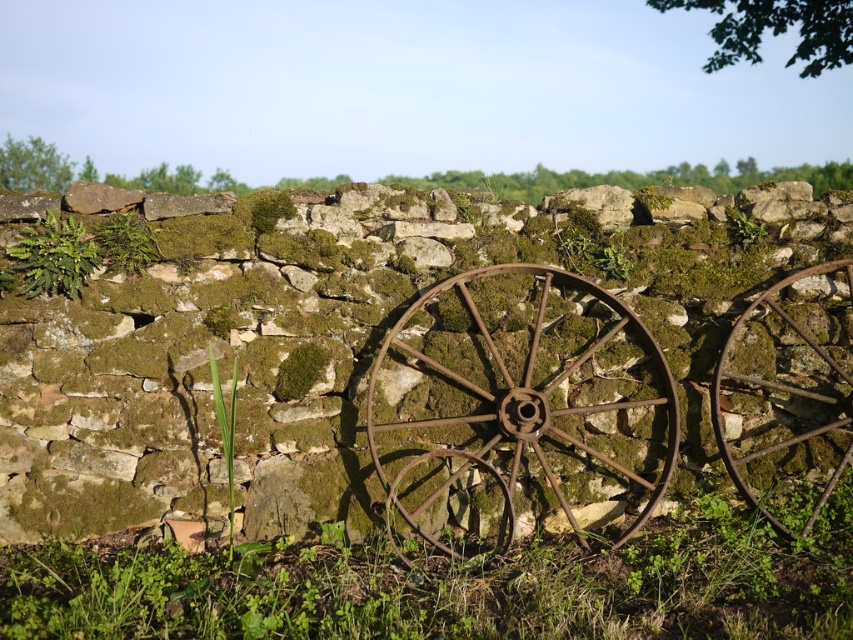
Does rusty metal wagon wheel at center have a larger size compared to green mossy plant at center?

Correct, rusty metal wagon wheel at center is larger in size than green mossy plant at center.

Which of these two, rusty metal wagon wheel at center or green mossy plant at center, stands taller?

rusty metal wagon wheel at center

Which is in front, point (431, 532) or point (624, 269)?

Point (431, 532) is in front.

Where is `rusty metal wagon wheel at center`? rusty metal wagon wheel at center is located at coordinates (520, 397).

Is point (463, 616) farther from camera compared to point (769, 449)?

No, (463, 616) is in front of (769, 449).

The width and height of the screenshot is (853, 640). I want to click on green leafy grass at lower center, so click(450, 586).

Is point (212, 336) closer to camera compared to point (595, 244)?

Yes, point (212, 336) is in front of point (595, 244).

Between point (212, 412) and point (616, 269), which one is positioned in front?

Point (212, 412) is more forward.

Between point (384, 362) and point (612, 253), which one is positioned behind?

Point (612, 253)

The width and height of the screenshot is (853, 640). Identify the location of rusty metal wheel at center. coord(432,364).